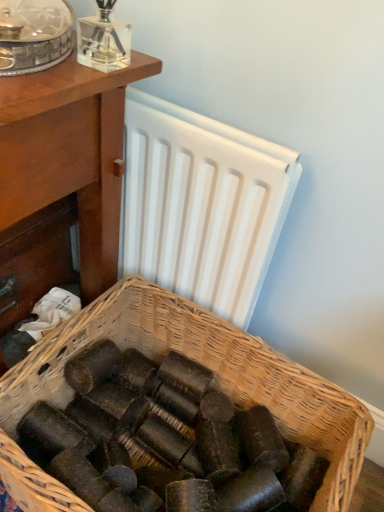
What do you see at coordinates (219, 371) in the screenshot? The height and width of the screenshot is (512, 384). I see `woven brown picnic basket at lower center` at bounding box center [219, 371].

You are a GUI agent. You are given a task and a screenshot of the screen. Output one action in this format:
    pyautogui.click(x=<x>, y=<y>)
    Task: Click on the woven brown picnic basket at lower center
    This screenshot has width=384, height=512.
    Given the screenshot: What is the action you would take?
    click(x=219, y=371)

What is the approximate width of woven brown picnic basket at lower center?

woven brown picnic basket at lower center is 18.81 inches wide.

What is the approximate height of woven brown picnic basket at lower center?

12.54 inches.

Identify the location of woven brown picnic basket at lower center. The height and width of the screenshot is (512, 384). (219, 371).